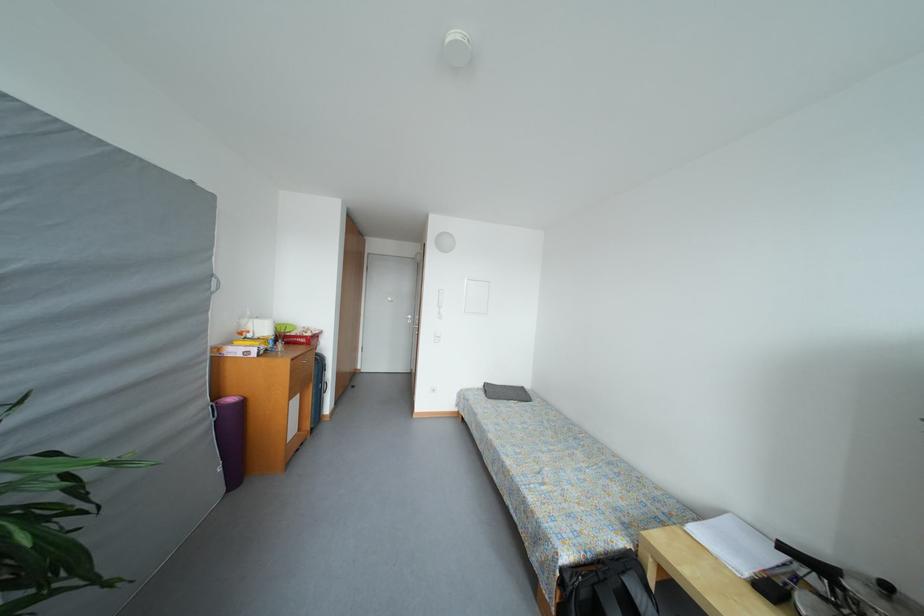
Where would you pull the drawer handle? Please return your answer as a coordinate pair (x, y).

(293, 431)